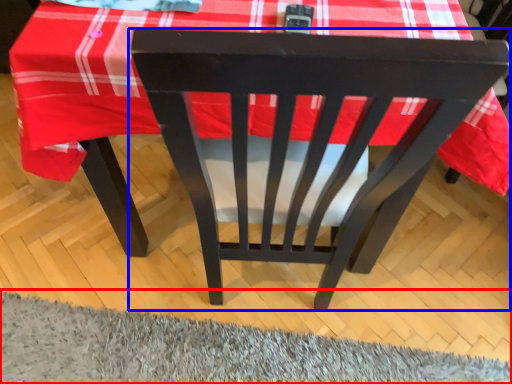
Question: Which object is closer to the camera taking this photo, mat (highlighted by a red box) or chair (highlighted by a blue box)?

Choices:
 (A) mat
 (B) chair

Answer: (A)